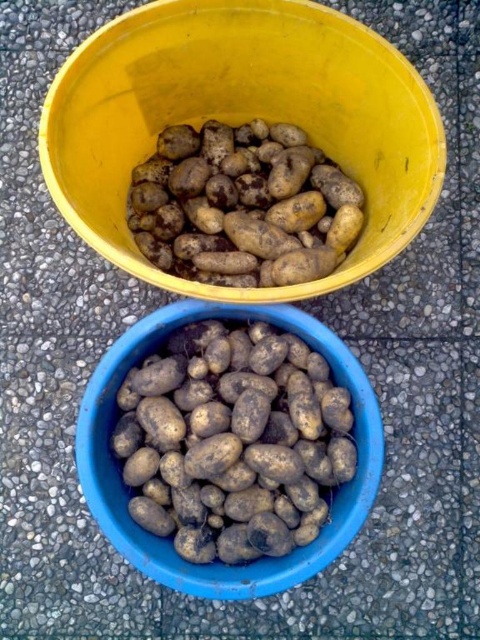
Between yellow plastic bucket at upper center and smooth brown potato at bottom center, which one is positioned lower?

smooth brown potato at bottom center

Is yellow plastic bucket at upper center to the left of smooth brown potato at bottom center from the viewer's perspective?

No, yellow plastic bucket at upper center is not to the left of smooth brown potato at bottom center.

Who is more distant from viewer, (49, 173) or (141, 468)?

Positioned behind is point (141, 468).

Identify the location of yellow plastic bucket at upper center. tap(240, 120).

Does yellow plastic bucket at upper center appear under brown matte potatoes at upper center?

No, yellow plastic bucket at upper center is not below brown matte potatoes at upper center.

Looking at this image, does yellow plastic bucket at upper center have a greater height compared to brown matte potatoes at upper center?

Yes.

Does point (276, 49) come farther from viewer compared to point (207, 262)?

No, it is in front of (207, 262).

Image resolution: width=480 pixels, height=640 pixels. I want to click on yellow plastic bucket at upper center, so click(x=240, y=120).

Can you confirm if smooth brown potato at bottom center is positioned to the left of brown matte potatoes at upper center?

Yes, smooth brown potato at bottom center is to the left of brown matte potatoes at upper center.

Can you confirm if smooth brown potato at bottom center is positioned to the right of brown matte potatoes at upper center?

Incorrect, smooth brown potato at bottom center is not on the right side of brown matte potatoes at upper center.

Does point (192, 442) come in front of point (204, 168)?

Yes, point (192, 442) is in front of point (204, 168).

Identify the location of smooth brown potato at bottom center. (232, 442).